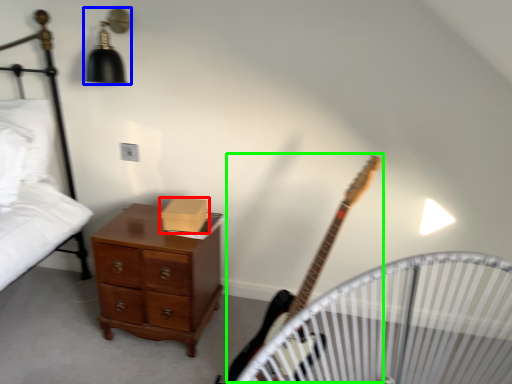
Question: Considering the real-world distances, which object is farthest from box (highlighted by a red box)? light fixture (highlighted by a blue box) or guitar (highlighted by a green box)?

Choices:
 (A) light fixture
 (B) guitar

Answer: (A)